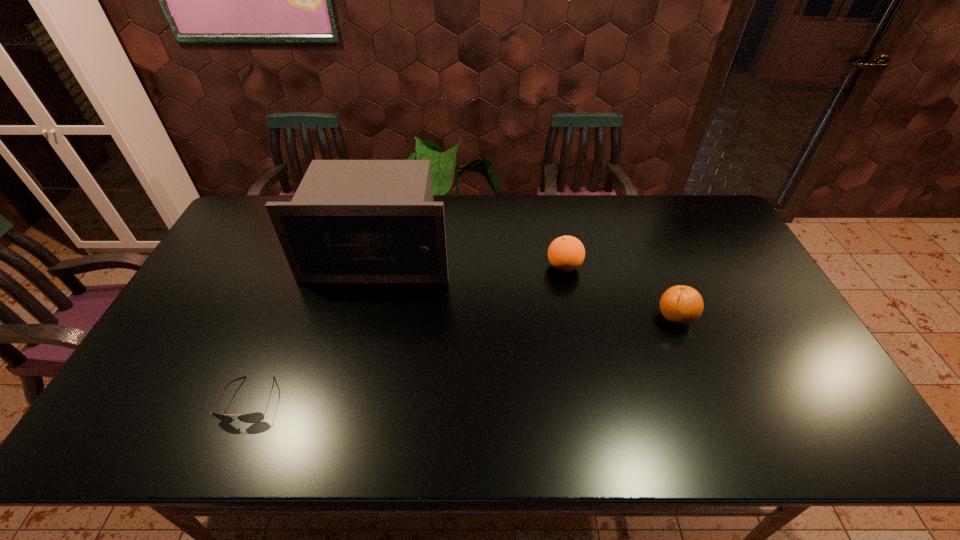
Locate an element on the screen. This screenshot has width=960, height=540. microwave oven is located at coordinates (350, 221).

The image size is (960, 540). In order to click on the second object from right to left in this screenshot , I will do `click(566, 253)`.

Identify the location of the left orange. (566, 253).

What are the coordinates of `the rightmost object` in the screenshot? It's located at (680, 304).

This screenshot has height=540, width=960. I want to click on the nearer orange, so click(x=680, y=304).

This screenshot has height=540, width=960. I want to click on the nearest object, so click(x=255, y=417).

In order to click on sunglasses in this screenshot , I will do `click(255, 417)`.

This screenshot has height=540, width=960. In order to click on vacant area situated on the front-facing side of the microwave oven in this screenshot , I will do `click(355, 356)`.

Image resolution: width=960 pixels, height=540 pixels. What are the coordinates of `free location located 0.300m on the right of the second object from right to left` in the screenshot? It's located at click(x=677, y=266).

Find the location of a particular element. The image size is (960, 540). vacant space located 0.060m on the front of the third farthest object is located at coordinates (689, 351).